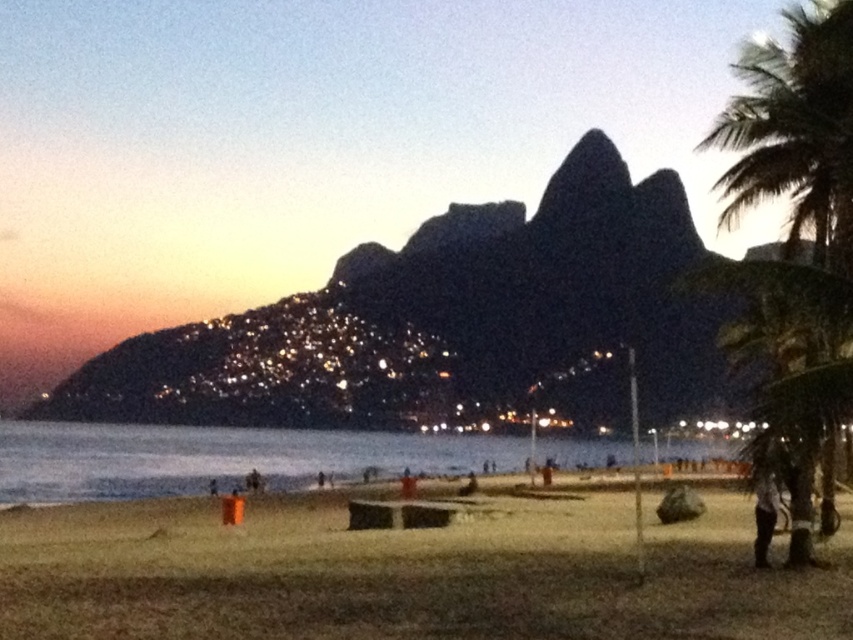
Can you confirm if green leafy palm tree at right is shorter than dark gray fabric pants at lower right?

No.

Is the position of green leafy palm tree at right more distant than that of dark gray fabric pants at lower right?

No, green leafy palm tree at right is in front of dark gray fabric pants at lower right.

Is point (805, 22) behind point (769, 504)?

That is True.

You are a GUI agent. You are given a task and a screenshot of the screen. Output one action in this format:
    pyautogui.click(x=<x>, y=<y>)
    Task: Click on the green leafy palm tree at right
    The image size is (853, 640).
    Given the screenshot: What is the action you would take?
    pyautogui.click(x=793, y=234)

The image size is (853, 640). Describe the element at coordinates (793, 234) in the screenshot. I see `green leafy palm tree at right` at that location.

Is point (764, 358) behind point (766, 461)?

Yes, point (764, 358) is farther from viewer.

Find the location of a particular element. The image size is (853, 640). green leafy palm tree at right is located at coordinates [793, 234].

Locate an element on the screen. green leafy palm tree at right is located at coordinates (793, 234).

Is brown sand at lower center to the left of dark gray fabric pants at lower right from the viewer's perspective?

Correct, you'll find brown sand at lower center to the left of dark gray fabric pants at lower right.

Measure the distance between brown sand at lower center and camera.

brown sand at lower center is 15.63 meters away from camera.

Find the location of a particular element. The width and height of the screenshot is (853, 640). brown sand at lower center is located at coordinates (409, 573).